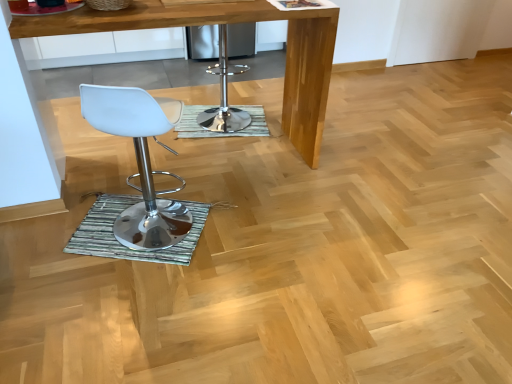
The image size is (512, 384). Find the location of `vacant area situated below wooden table at center (from a real-world perspective)`. vacant area situated below wooden table at center (from a real-world perspective) is located at coordinates (194, 161).